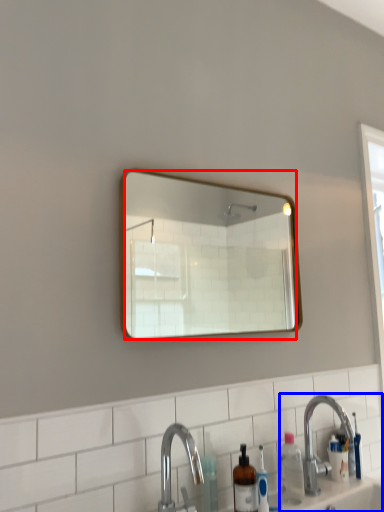
Question: Which object appears closest to the camera in this image, mirror (highlighted by a red box) or sink (highlighted by a blue box)?

Choices:
 (A) mirror
 (B) sink

Answer: (A)